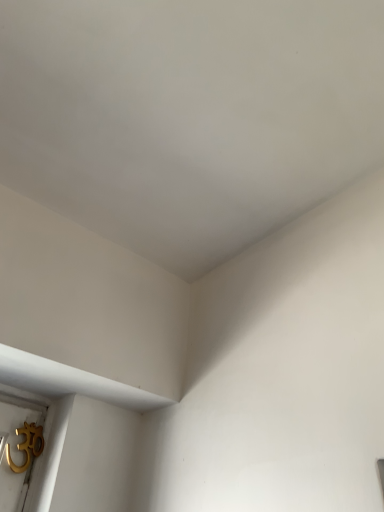
In order to face gold metallic om symbol at lower left, should I rotate leftwards or rightwards?

You should rotate left by 21.597 degrees.

What do you see at coordinates (27, 446) in the screenshot?
I see `gold metallic om symbol at lower left` at bounding box center [27, 446].

Locate an element on the screen. gold metallic om symbol at lower left is located at coordinates (27, 446).

Where is `gold metallic om symbol at lower left`? The height and width of the screenshot is (512, 384). gold metallic om symbol at lower left is located at coordinates [x=27, y=446].